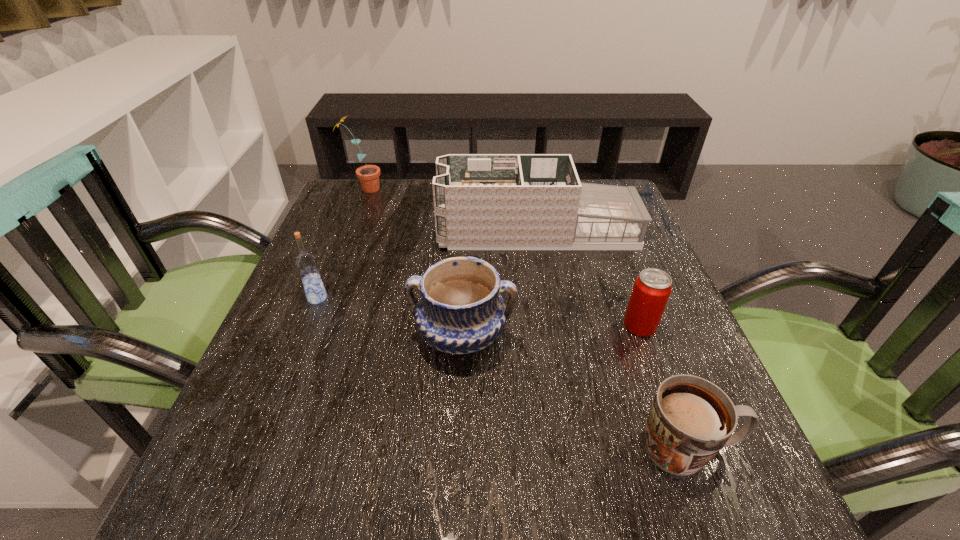
Where is `can at the right edge`? This screenshot has height=540, width=960. can at the right edge is located at coordinates (652, 288).

Locate an element on the screen. The image size is (960, 540). mug that is at the right edge is located at coordinates (690, 420).

Where is `object situated at the far left corner`? Image resolution: width=960 pixels, height=540 pixels. object situated at the far left corner is located at coordinates (368, 175).

Where is `object located in the far right corner section of the desktop`? The width and height of the screenshot is (960, 540). object located in the far right corner section of the desktop is located at coordinates (481, 201).

You are a GUI agent. You are given a task and a screenshot of the screen. Output one action in this format:
    pyautogui.click(x=<x>, y=<y>)
    Task: Click on the object at the near right corner
    Image resolution: width=960 pixels, height=540 pixels.
    Given the screenshot: What is the action you would take?
    pyautogui.click(x=690, y=420)

In the image, there is a desktop. In order to click on blank space at the far edge in this screenshot , I will do `click(394, 214)`.

In the image, there is a desktop. Where is `vacant space at the left edge`? This screenshot has height=540, width=960. vacant space at the left edge is located at coordinates (254, 458).

Find the location of a particular element. vacant space at the far left corner is located at coordinates (345, 214).

Image resolution: width=960 pixels, height=540 pixels. In order to click on free space at the near left corner of the desktop in this screenshot , I will do `click(218, 517)`.

Locate an element on the screen. Image resolution: width=960 pixels, height=540 pixels. free spot between the pottery and the farthest object is located at coordinates (413, 262).